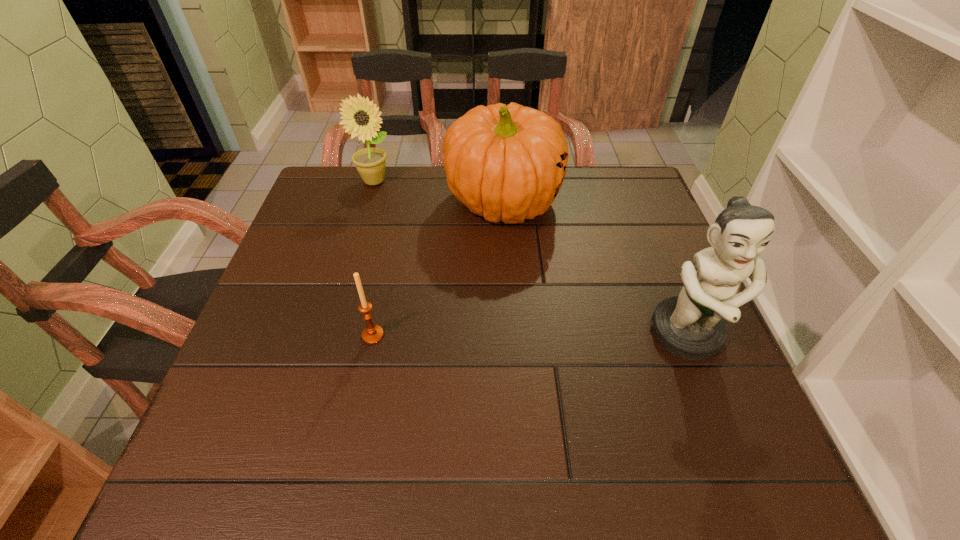
This screenshot has width=960, height=540. What are the coordinates of `vacant area situated 0.090m on the face of the sunflower` in the screenshot? It's located at (395, 206).

Image resolution: width=960 pixels, height=540 pixels. Identify the location of vacant space located on the face of the sunflower. (444, 273).

The image size is (960, 540). I want to click on vacant space located 0.350m on the face of the sunflower, so click(437, 263).

Where is `pumpkin at the far edge`? pumpkin at the far edge is located at coordinates (505, 162).

Identify the location of sunflower that is at the far edge. (361, 117).

Find the location of a particular element. object at the left edge is located at coordinates (361, 117).

Where is `object present at the right edge`? object present at the right edge is located at coordinates point(691,326).

Find the location of a particular element. The width and height of the screenshot is (960, 540). object located at the far left corner is located at coordinates (361, 117).

Identify the location of free region at the far edge of the desktop. (390, 197).

Image resolution: width=960 pixels, height=540 pixels. In order to click on free space at the near edge of the desktop in this screenshot , I will do `click(312, 400)`.